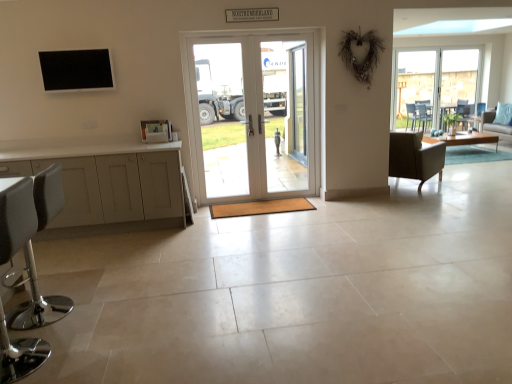
Question: Does white leather stool at lower left, the 1th chair ordered from the bottom, turn towards light brown wooden coffee table at right?

Choices:
 (A) no
 (B) yes

Answer: (A)

Question: Can you confirm if white leather stool at lower left, which is the first chair from left to right, is bigger than light brown wooden coffee table at right?

Choices:
 (A) no
 (B) yes

Answer: (A)

Question: From a real-world perspective, is white leather stool at lower left, which is counted as the second chair, starting from the back, physically above light brown wooden coffee table at right?

Choices:
 (A) yes
 (B) no

Answer: (A)

Question: From the image's perspective, is white leather stool at lower left, placed as the 1th chair when sorted from front to back, below light brown wooden coffee table at right?

Choices:
 (A) no
 (B) yes

Answer: (B)

Question: Can you confirm if white leather stool at lower left, which is counted as the second chair, starting from the back, is taller than light brown wooden coffee table at right?

Choices:
 (A) no
 (B) yes

Answer: (B)

Question: Can you confirm if white leather stool at lower left, the second chair in the right-to-left sequence, is shorter than light brown wooden coffee table at right?

Choices:
 (A) yes
 (B) no

Answer: (B)

Question: From the image's perspective, is white glossy door at center located beneath dark brown leather chair at right, the first chair from the back?

Choices:
 (A) yes
 (B) no

Answer: (B)

Question: From a real-world perspective, is white glossy door at center located beneath dark brown leather chair at right, which is counted as the second chair, starting from the front?

Choices:
 (A) no
 (B) yes

Answer: (A)

Question: Does white glossy door at center have a larger size compared to dark brown leather chair at right, marked as the 2th chair in a bottom-to-top arrangement?

Choices:
 (A) no
 (B) yes

Answer: (A)

Question: Considering the relative positions of white glossy door at center and dark brown leather chair at right, which is counted as the second chair, starting from the front, in the image provided, is white glossy door at center behind dark brown leather chair at right, which is counted as the second chair, starting from the front,?

Choices:
 (A) no
 (B) yes

Answer: (A)

Question: Does white glossy door at center have a lesser height compared to dark brown leather chair at right, arranged as the first chair when viewed from the top?

Choices:
 (A) yes
 (B) no

Answer: (B)

Question: Is white glossy door at center thinner than dark brown leather chair at right, the first chair from the back?

Choices:
 (A) yes
 (B) no

Answer: (A)

Question: From the image's perspective, does light blue fabric couch at right appear lower than white glossy door at center?

Choices:
 (A) no
 (B) yes

Answer: (A)